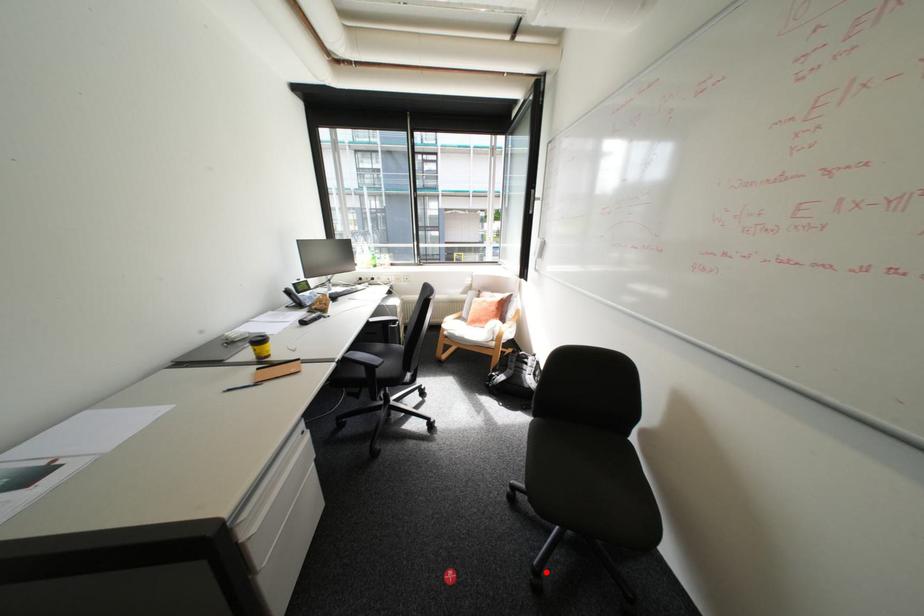
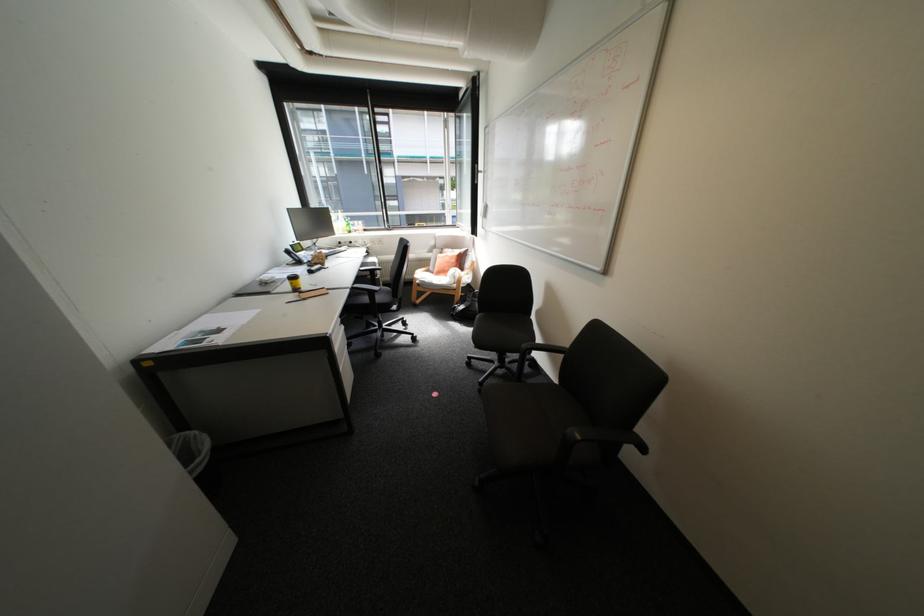
Question: A red point is marked in image1. In image2, is the corresponding 3D point closer to the camera or farther? Reply with the corresponding letter.

Choices:
 (A) The corresponding 3D point is closer.
 (B) The corresponding 3D point is farther.

Answer: (A)